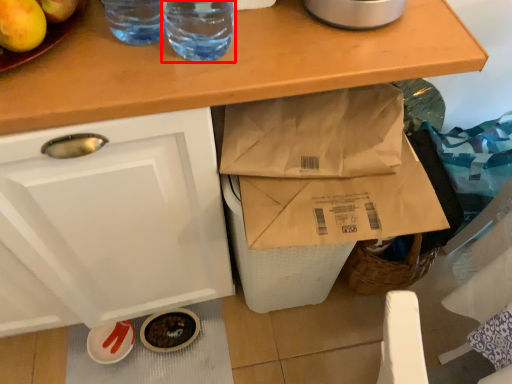
Question: Considering the relative positions of drinking straw (annotated by the red box) and drinking straw in the image provided, where is drinking straw (annotated by the red box) located with respect to the staircase?

Choices:
 (A) left
 (B) right

Answer: (B)